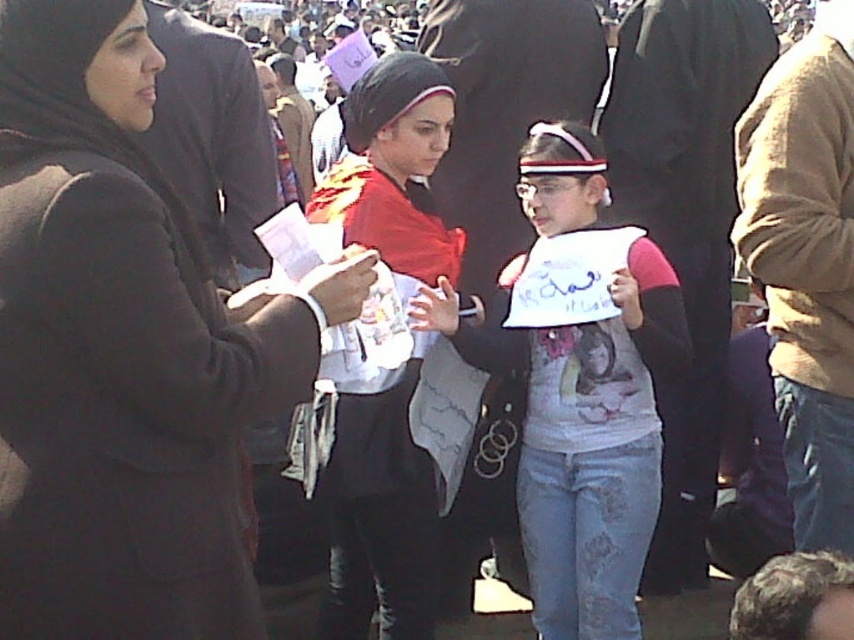
You are a photographer trying to capture a clear shot of the white paper sign at center and the matte black hijab at center. Based on their sizes, which object would appear larger in your photo?

The white paper sign at center might appear larger in the photo since it is wider than the matte black hijab at center.

You are organizing a parade and need to ensure visibility between the dark brown coat at left and the white paper sign at center. Which object is smaller and might be less noticeable from a distance?

The dark brown coat at left is smaller in size compared to the white paper sign at center, so it might be less noticeable from a distance.